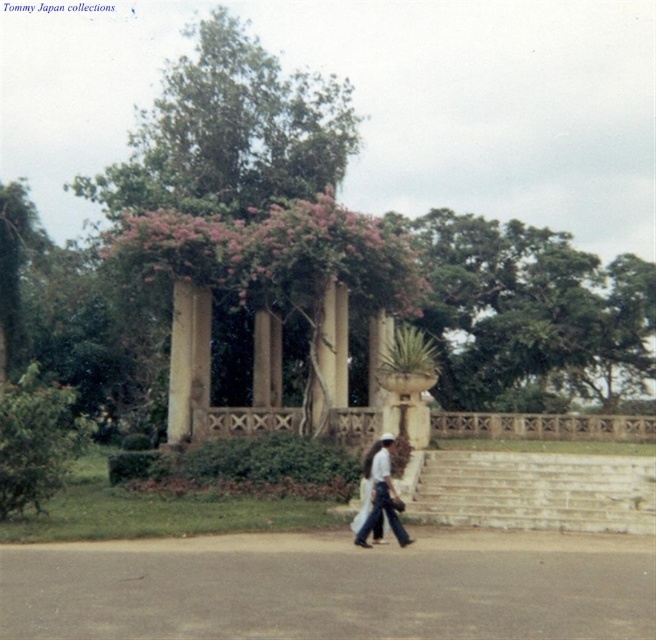
You are standing at the point labeled as point (272, 291) in the image. What structure are you currently standing on?

You are standing on the beige stone gazebo at center.

You are standing in the outdoor scene and want to reach the point marked at coordinates [533,518]. If your walking speed is 1.2 meters per second, how many seconds will it take you to reach that point?

The point at coordinates [533,518] is 17.28 meters away from you. At a walking speed of 1.2 meters per second, it will take you 14.4 seconds to reach it.